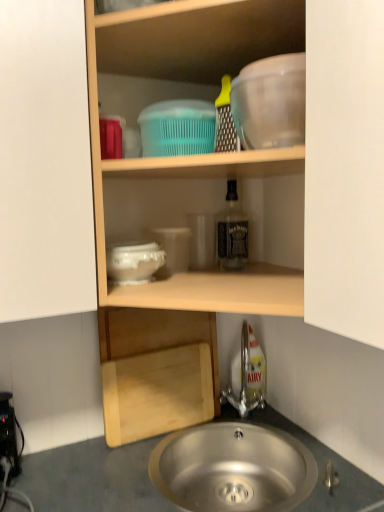
At what (x,y) coordinates should I click in order to perform the action: click on vacant space situated above smooth gray countertop at lower center (from a real-world perspective). Please return your answer as a coordinate pair (x, y). Looking at the image, I should click on (156, 475).